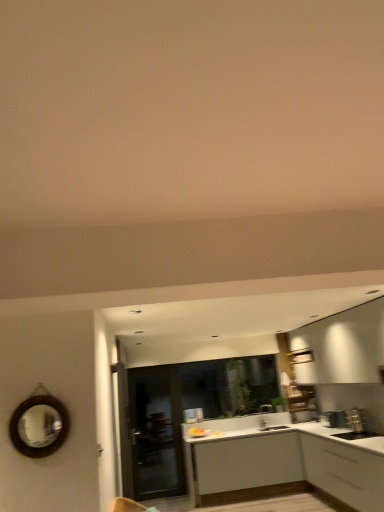
How much space does white matte cabinet at lower right, the 2th cabinetry positioned from the back, occupy horizontally?

The width of white matte cabinet at lower right, the 2th cabinetry positioned from the back, is 23.58 inches.

Describe the element at coordinates (264, 416) in the screenshot. I see `silver metallic faucet at center` at that location.

How much space does white matte cabinet at center, the first cabinetry when ordered from back to front, occupy vertically?

It is 36.70 inches.

The width and height of the screenshot is (384, 512). What do you see at coordinates (282, 463) in the screenshot? I see `white matte cabinet at center, marked as the second cabinetry in a front-to-back arrangement` at bounding box center [282, 463].

I want to click on white matte cabinet at lower right, marked as the 1th cabinetry in a front-to-back arrangement, so click(x=345, y=472).

How distant is white matte cabinet at lower right, marked as the 1th cabinetry in a front-to-back arrangement, from white matte cabinet at center, the first cabinetry when ordered from back to front?

The distance of white matte cabinet at lower right, marked as the 1th cabinetry in a front-to-back arrangement, from white matte cabinet at center, the first cabinetry when ordered from back to front, is 10.36 inches.

Is point (334, 459) closer to camera compared to point (366, 494)?

That is False.

Does white matte cabinet at lower right, the 2th cabinetry positioned from the back, lie behind white matte cabinet at center, marked as the second cabinetry in a front-to-back arrangement?

No, it is not.

In terms of size, does white matte cabinet at lower right, marked as the 1th cabinetry in a front-to-back arrangement, appear bigger or smaller than white matte cabinet at center, marked as the second cabinetry in a front-to-back arrangement?

Clearly, white matte cabinet at lower right, marked as the 1th cabinetry in a front-to-back arrangement, is larger in size than white matte cabinet at center, marked as the second cabinetry in a front-to-back arrangement.

Can you confirm if matte black door at center is bigger than transparent glass door at center?

No.

In the image, is matte black door at center on the left side or the right side of transparent glass door at center?

Based on their positions, matte black door at center is located to the left of transparent glass door at center.

Between matte black door at center and transparent glass door at center, which one is positioned behind?

transparent glass door at center.

Considering the sizes of objects white matte cabinet at center, the first cabinetry when ordered from back to front, and matte black door at center in the image provided, who is taller, white matte cabinet at center, the first cabinetry when ordered from back to front, or matte black door at center?

With more height is matte black door at center.

From the image's perspective, is white matte cabinet at center, marked as the second cabinetry in a front-to-back arrangement, below matte black door at center?

Yes, from the image's perspective, white matte cabinet at center, marked as the second cabinetry in a front-to-back arrangement, is below matte black door at center.

Considering the sizes of white matte cabinet at center, marked as the second cabinetry in a front-to-back arrangement, and matte black door at center in the image, is white matte cabinet at center, marked as the second cabinetry in a front-to-back arrangement, wider or thinner than matte black door at center?

In the image, white matte cabinet at center, marked as the second cabinetry in a front-to-back arrangement, appears to be wider than matte black door at center.

Considering the relative sizes of white matte cabinet at center, marked as the second cabinetry in a front-to-back arrangement, and silver metallic faucet at center in the image provided, is white matte cabinet at center, marked as the second cabinetry in a front-to-back arrangement, taller than silver metallic faucet at center?

Yes, white matte cabinet at center, marked as the second cabinetry in a front-to-back arrangement, is taller than silver metallic faucet at center.

Considering the sizes of objects white matte cabinet at center, the first cabinetry when ordered from back to front, and silver metallic faucet at center in the image provided, who is thinner, white matte cabinet at center, the first cabinetry when ordered from back to front, or silver metallic faucet at center?

silver metallic faucet at center.

Is white matte cabinet at center, marked as the second cabinetry in a front-to-back arrangement, in front of or behind silver metallic faucet at center in the image?

white matte cabinet at center, marked as the second cabinetry in a front-to-back arrangement, is in front of silver metallic faucet at center.

From the picture: Which is correct: brown wooden mirror at left is inside transparent glass door at center, or outside of it?

The correct answer is: outside.

Is brown wooden mirror at left far away from transparent glass door at center?

Indeed, brown wooden mirror at left is not near transparent glass door at center.

Which of these two, brown wooden mirror at left or transparent glass door at center, is thinner?

With smaller width is brown wooden mirror at left.

Which of these two, brown wooden mirror at left or transparent glass door at center, stands taller?

transparent glass door at center.

Considering the sizes of objects silver metallic faucet at center and white matte cabinet at lower right, marked as the 1th cabinetry in a front-to-back arrangement, in the image provided, who is wider, silver metallic faucet at center or white matte cabinet at lower right, marked as the 1th cabinetry in a front-to-back arrangement,?

Wider between the two is white matte cabinet at lower right, marked as the 1th cabinetry in a front-to-back arrangement.

Does point (266, 409) come closer to viewer compared to point (307, 451)?

No, it is not.

Considering the relative sizes of silver metallic faucet at center and white matte cabinet at lower right, marked as the 1th cabinetry in a front-to-back arrangement, in the image provided, is silver metallic faucet at center bigger than white matte cabinet at lower right, marked as the 1th cabinetry in a front-to-back arrangement,?

No, silver metallic faucet at center is not bigger than white matte cabinet at lower right, marked as the 1th cabinetry in a front-to-back arrangement.

Where is `tap above the white matte cabinet at lower right, marked as the 1th cabinetry in a front-to-back arrangement (from a real-world perspective)`? This screenshot has height=512, width=384. tap above the white matte cabinet at lower right, marked as the 1th cabinetry in a front-to-back arrangement (from a real-world perspective) is located at coordinates (264, 416).

Are brown wooden mirror at left and silver metallic faucet at center located far from each other?

Yes.

From their relative heights in the image, would you say brown wooden mirror at left is taller or shorter than silver metallic faucet at center?

Clearly, brown wooden mirror at left is taller compared to silver metallic faucet at center.

Which is more to the left, brown wooden mirror at left or silver metallic faucet at center?

brown wooden mirror at left is more to the left.

Is brown wooden mirror at left positioned with its back to silver metallic faucet at center?

No, silver metallic faucet at center is not at the back of brown wooden mirror at left.

The height and width of the screenshot is (512, 384). I want to click on cabinetry lying on the left of white matte cabinet at lower right, marked as the 1th cabinetry in a front-to-back arrangement, so click(x=282, y=463).

I want to click on door in front of the transparent glass door at center, so click(x=121, y=432).

When comparing their distances from brown wooden mirror at left, does white matte cabinet at lower right, marked as the 1th cabinetry in a front-to-back arrangement, or silver metallic faucet at center seem further?

silver metallic faucet at center is positioned further to the anchor brown wooden mirror at left.

Looking at the image, which one is located further to silver metallic faucet at center, brown wooden mirror at left or matte black door at center?

Among the two, brown wooden mirror at left is located further to silver metallic faucet at center.

Looking at the image, which one is located further to white matte cabinet at lower right, the 2th cabinetry positioned from the back, white matte cabinet at center, the first cabinetry when ordered from back to front, or brown wooden mirror at left?

Among the two, brown wooden mirror at left is located further to white matte cabinet at lower right, the 2th cabinetry positioned from the back.

Looking at the image, which one is located further to white matte cabinet at center, the first cabinetry when ordered from back to front, matte black door at center or white matte cabinet at lower right, the 2th cabinetry positioned from the back?

matte black door at center lies further to white matte cabinet at center, the first cabinetry when ordered from back to front, than the other object.

Based on their spatial positions, is matte black door at center or transparent glass door at center further from white matte cabinet at center, marked as the second cabinetry in a front-to-back arrangement?

The object further to white matte cabinet at center, marked as the second cabinetry in a front-to-back arrangement, is matte black door at center.

When comparing their distances from silver metallic faucet at center, does matte black door at center or brown wooden mirror at left seem further?

The object further to silver metallic faucet at center is brown wooden mirror at left.

When comparing their distances from brown wooden mirror at left, does white matte cabinet at lower right, marked as the 1th cabinetry in a front-to-back arrangement, or transparent glass door at center seem closer?

transparent glass door at center is positioned closer to the anchor brown wooden mirror at left.

Based on their spatial positions, is matte black door at center or silver metallic faucet at center further from white matte cabinet at lower right, marked as the 1th cabinetry in a front-to-back arrangement?

matte black door at center is further to white matte cabinet at lower right, marked as the 1th cabinetry in a front-to-back arrangement.

Locate an element on the screen. cabinetry between matte black door at center and silver metallic faucet at center along the z-axis is located at coordinates click(282, 463).

Image resolution: width=384 pixels, height=512 pixels. Identify the location of door located between white matte cabinet at lower right, the 2th cabinetry positioned from the back, and silver metallic faucet at center in the depth direction. (121, 432).

Locate an element on the screen. glass door between white matte cabinet at lower right, the 2th cabinetry positioned from the back, and silver metallic faucet at center from front to back is located at coordinates (156, 431).

You are a GUI agent. You are given a task and a screenshot of the screen. Output one action in this format:
    pyautogui.click(x=<x>, y=<y>)
    Task: Click on the door between brown wooden mirror at left and white matte cabinet at center, marked as the second cabinetry in a front-to-back arrangement, from front to back
    
    Given the screenshot: What is the action you would take?
    pyautogui.click(x=121, y=432)